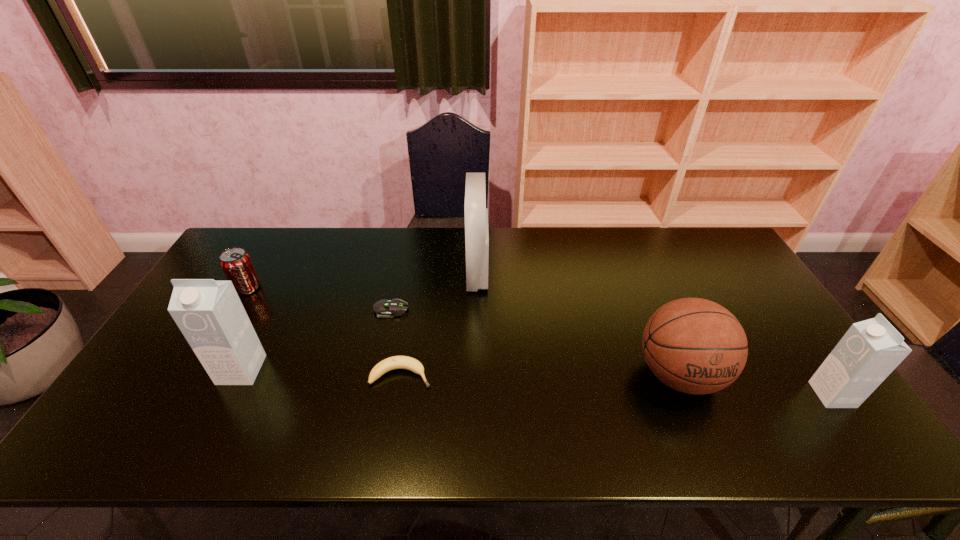
Identify which object is the third closest to the second object from right to left. Please provide its 2D coordinates. Your answer should be formatted as a tuple, i.e. [(x, y)], where the tuple contains the x and y coordinates of a point satisfying the conditions above.

[(396, 362)]

Identify the location of the sixth closest object to the fifth nearest object. (870, 350).

Where is `free space that satisfies the following two spatial constraints: 1. on the front-facing side of the third object from right to left; 2. on the front side of the shortest object`? The height and width of the screenshot is (540, 960). free space that satisfies the following two spatial constraints: 1. on the front-facing side of the third object from right to left; 2. on the front side of the shortest object is located at coordinates (477, 310).

Where is `blank area in the image that satisfies the following two spatial constraints: 1. on the side with brand label of the second object from right to left; 2. at the stem of the banana`? This screenshot has width=960, height=540. blank area in the image that satisfies the following two spatial constraints: 1. on the side with brand label of the second object from right to left; 2. at the stem of the banana is located at coordinates (680, 375).